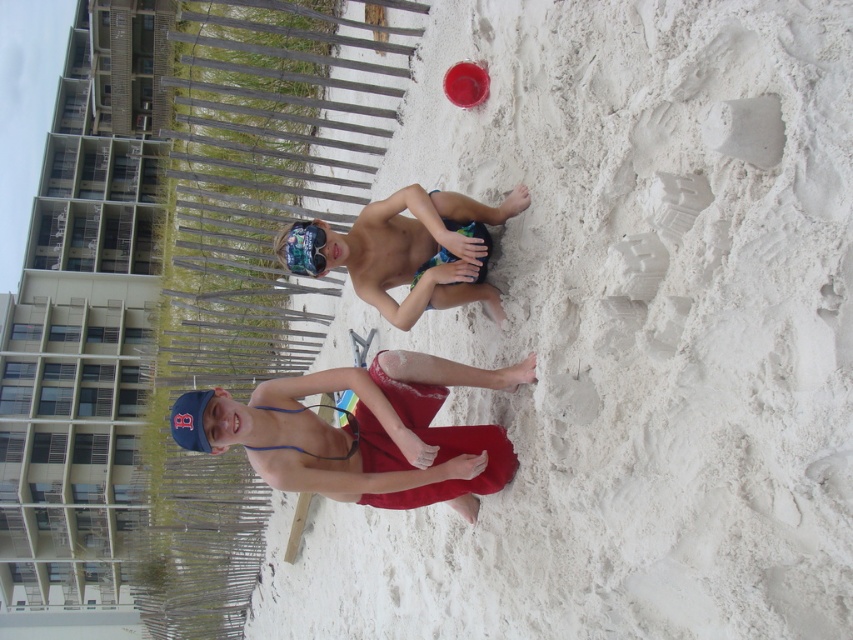
From the picture: You are a photographer trying to capture both the white sandy beach at center and the red fabric shorts at center in a single shot. Based on their heights, which object should you focus on first to ensure both are in clear view?

The white sandy beach at center has a greater height compared to red fabric shorts at center, so you should focus on the white sandy beach at center first to ensure both are in clear view.

You are a child trying to find a place to set up a sandcastle. The white sandy beach at center and the blue rubber goggles at center are both in your view. Which area would allow you to build a larger sandcastle?

The white sandy beach at center is wider than the blue rubber goggles at center, so it would provide more space to build a larger sandcastle.